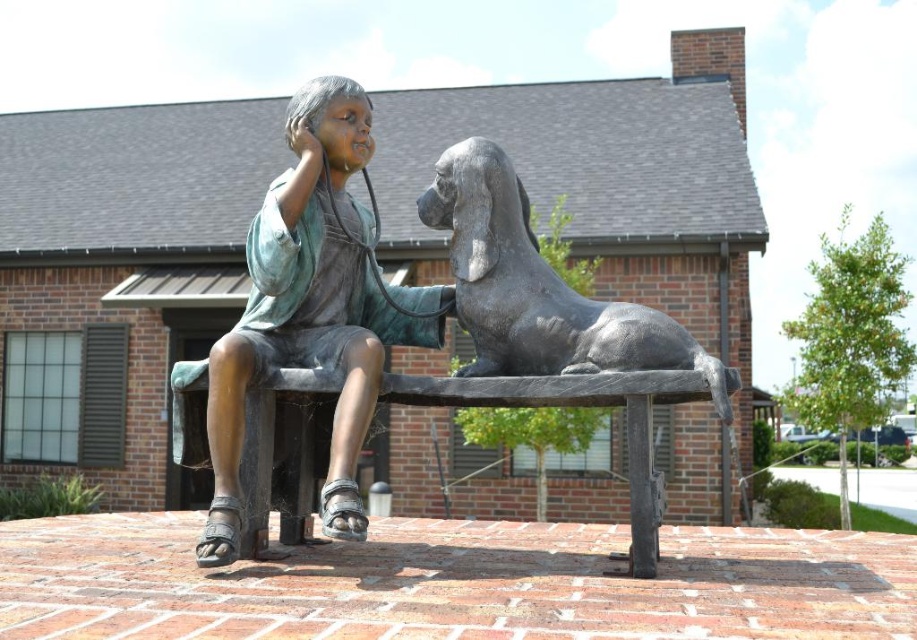
Which is more to the right, bronze statue of child at center or bronze statue of dog at center?

bronze statue of dog at center

Who is more distant from viewer, (340, 513) or (551, 339)?

Point (551, 339)

Who is more forward, (263, 288) or (496, 348)?

Point (263, 288) is in front.

The height and width of the screenshot is (640, 917). Find the location of `bronze statue of child at center`. bronze statue of child at center is located at coordinates (313, 308).

Consider the image. Can you confirm if bronze statue of dog at center is positioned below bronze bench at center?

No.

Who is taller, bronze statue of dog at center or bronze bench at center?

With more height is bronze statue of dog at center.

This screenshot has width=917, height=640. What do you see at coordinates (538, 288) in the screenshot? I see `bronze statue of dog at center` at bounding box center [538, 288].

Where is `bronze statue of dog at center`? The image size is (917, 640). bronze statue of dog at center is located at coordinates (538, 288).

Who is higher up, bronze statue of child at center or bronze bench at center?

bronze statue of child at center

Between point (299, 292) and point (280, 438), which one is positioned behind?

The point (280, 438) is behind.

Does point (272, 305) come farther from viewer compared to point (442, 403)?

No, (272, 305) is in front of (442, 403).

Locate an element on the screen. The width and height of the screenshot is (917, 640). bronze statue of child at center is located at coordinates (313, 308).